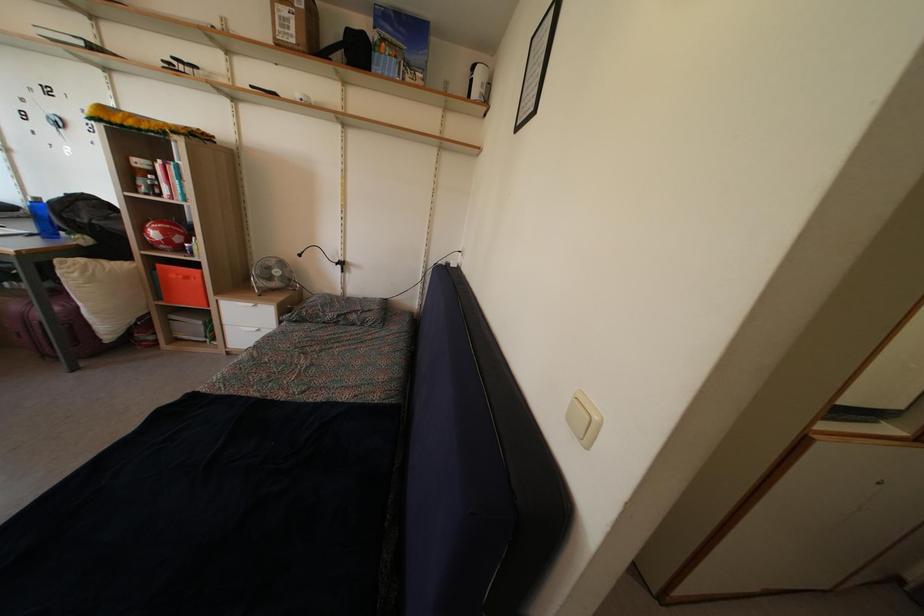
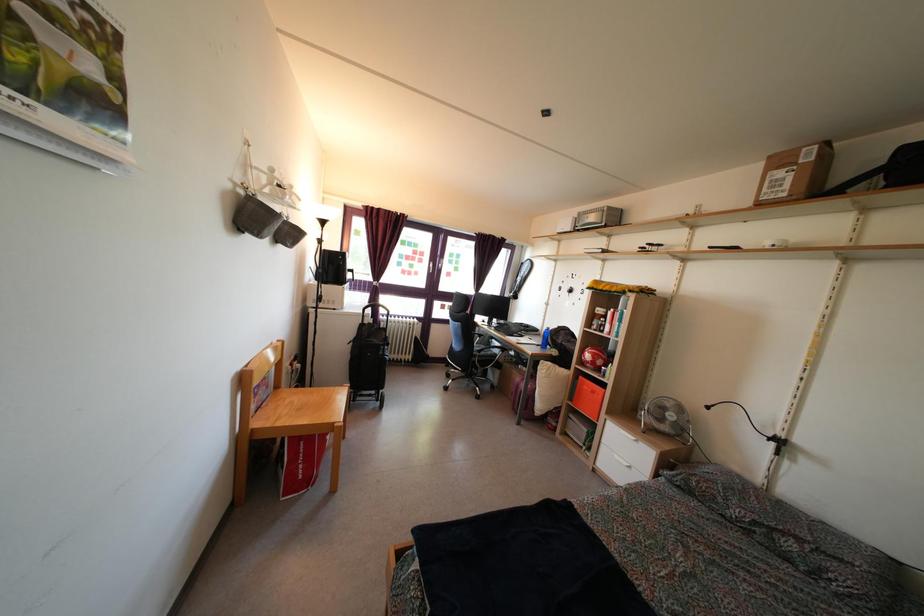
Question: The first image is from the beginning of the video and the second image is from the end. How did the camera likely rotate when shooting the video?

Choices:
 (A) Left
 (B) Right
 (C) Up
 (D) Down

Answer: (A)